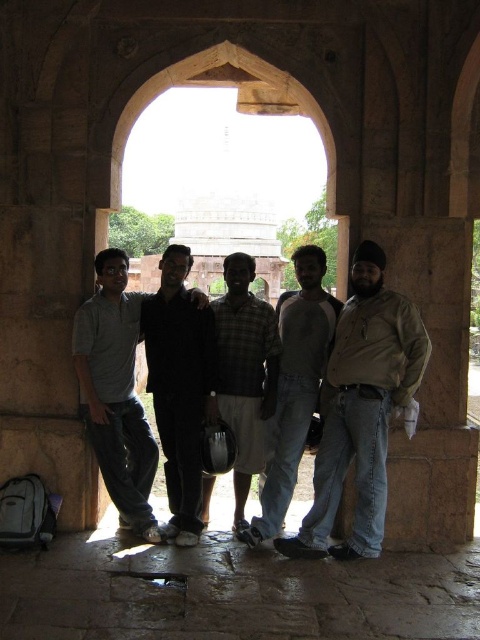
Question: Which object appears farthest from the camera in this image?

Choices:
 (A) brown leather jacket at center
 (B) dark gray cotton shirt at center
 (C) dark gray jeans at center

Answer: (B)

Question: Can you confirm if dark gray cotton shirt at center is bigger than checkered fabric shirt at center?

Choices:
 (A) yes
 (B) no

Answer: (B)

Question: Which of the following is the farthest from the observer?

Choices:
 (A) dark gray cotton shirt at center
 (B) dark gray jeans at center
 (C) light gray cotton pants at center
 (D) checkered fabric shirt at center

Answer: (D)

Question: Which object is closer to the camera taking this photo?

Choices:
 (A) brown leather jacket at center
 (B) checkered fabric shirt at center
 (C) light gray cotton pants at center
 (D) dark gray jeans at center

Answer: (A)

Question: Can you confirm if brown leather jacket at center is positioned above checkered fabric shirt at center?

Choices:
 (A) no
 (B) yes

Answer: (A)

Question: Is brown leather jacket at center to the right of dark gray jeans at center from the viewer's perspective?

Choices:
 (A) yes
 (B) no

Answer: (A)